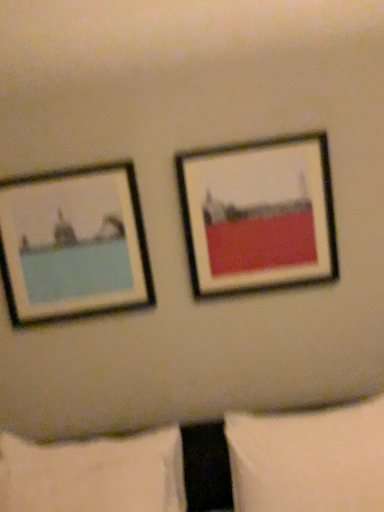
Question: From a real-world perspective, relative to white soft pillow at lower right, positioned as the 2th pillow in left-to-right order, is white soft pillow at lower left, marked as the second pillow in a right-to-left arrangement, vertically above or below?

Choices:
 (A) above
 (B) below

Answer: (A)

Question: From the image's perspective, is white soft pillow at lower left, marked as the second pillow in a right-to-left arrangement, located above or below white soft pillow at lower right, positioned as the 2th pillow in left-to-right order?

Choices:
 (A) below
 (B) above

Answer: (A)

Question: Which is nearer to the white soft pillow at lower right, positioned as the 2th pillow in left-to-right order?

Choices:
 (A) white soft pillow at lower left, positioned as the 1th pillow in left-to-right order
 (B) matte black picture frame at left, which appears as the second picture frame when viewed from the right
 (C) matte black picture frame at upper right, the first picture frame when ordered from right to left

Answer: (A)

Question: Estimate the real-world distances between objects in this image. Which object is closer to the matte black picture frame at upper right, the first picture frame when ordered from right to left?

Choices:
 (A) white soft pillow at lower right, the first pillow in the right-to-left sequence
 (B) white soft pillow at lower left, positioned as the 1th pillow in left-to-right order
 (C) matte black picture frame at left, which is the 1th picture frame from left to right

Answer: (C)